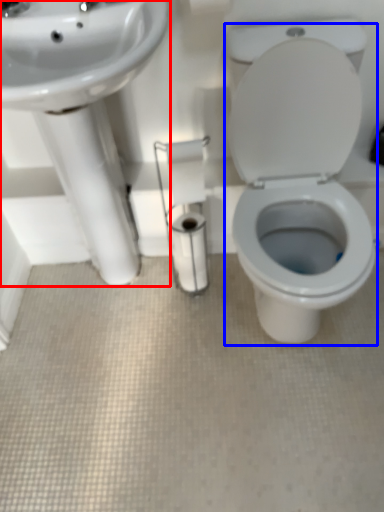
Question: Which of the following is the closest to the observer, sink (highlighted by a red box) or porcelain (highlighted by a blue box)?

Choices:
 (A) sink
 (B) porcelain

Answer: (B)